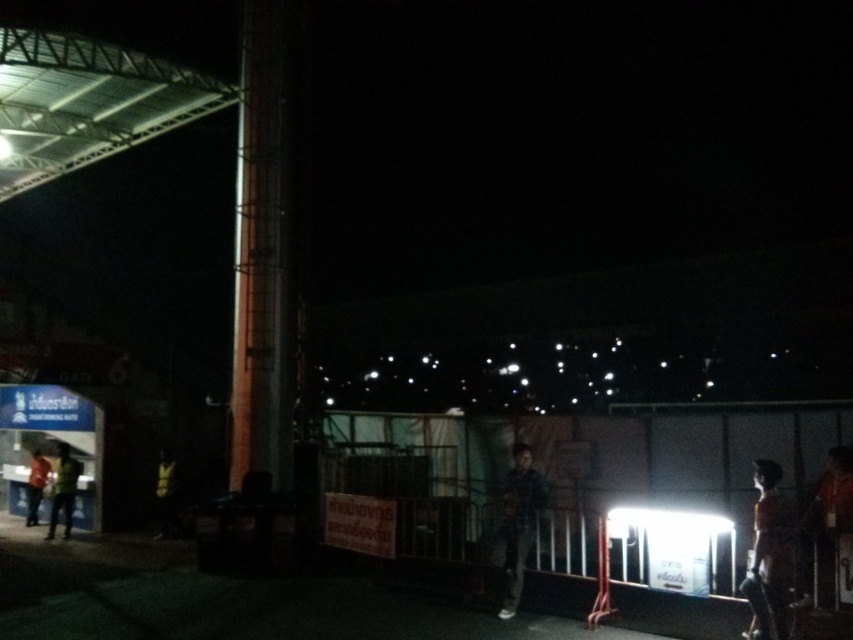
Can you confirm if blue plastic signboard at lower left is positioned to the right of orange fabric shirt at right?

No, blue plastic signboard at lower left is not to the right of orange fabric shirt at right.

Can you confirm if blue plastic signboard at lower left is thinner than orange fabric shirt at right?

Incorrect, blue plastic signboard at lower left's width is not less than orange fabric shirt at right's.

What are the coordinates of `blue plastic signboard at lower left` in the screenshot? It's located at (51, 445).

Is dark fabric jacket at left thinner than orange shirt at left?

Indeed, dark fabric jacket at left has a lesser width compared to orange shirt at left.

Between point (161, 488) and point (38, 452), which one is positioned behind?

Point (38, 452)

This screenshot has height=640, width=853. Identify the location of dark fabric jacket at left. (165, 493).

Can you confirm if orange fabric shirt at right is bigger than dark fabric jacket at left?

Yes, orange fabric shirt at right is bigger than dark fabric jacket at left.

Does orange fabric shirt at right appear over dark fabric jacket at left?

Yes.

The image size is (853, 640). Find the location of `orange fabric shirt at right`. orange fabric shirt at right is located at coordinates (769, 556).

Locate an element on the screen. orange fabric shirt at right is located at coordinates (769, 556).